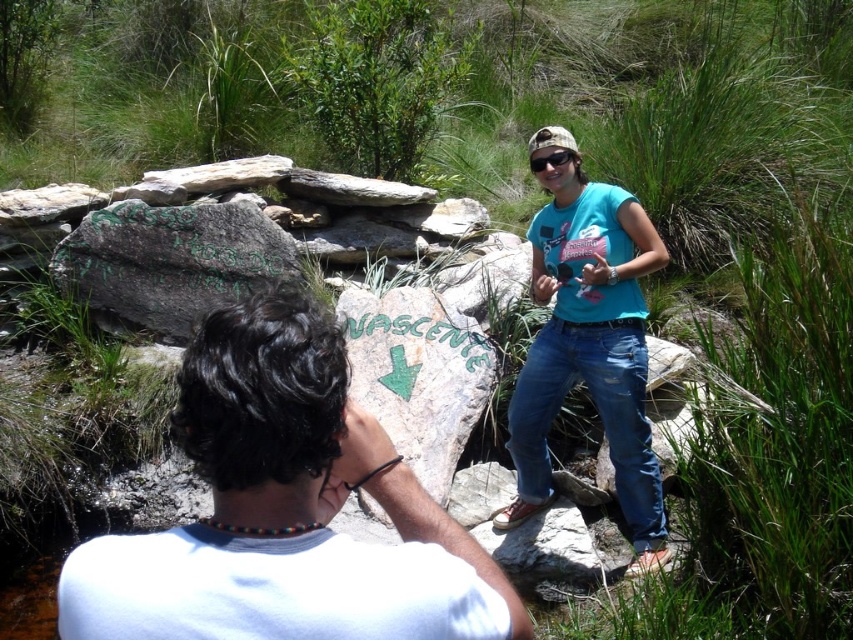
Based on the scene description, can the width of the white matte shirt at center and the matte black goggles at upper center be compared?

The white matte shirt at center is wider than the matte black goggles at upper center according to the description.

You are a photographer trying to capture a clear shot of the white matte shirt at center and the matte black goggles at upper center. Since you want both items to be visible in the frame, does the size difference between them affect your ability to do so?

The white matte shirt at center is larger in size than the matte black goggles at upper center, so the size difference won